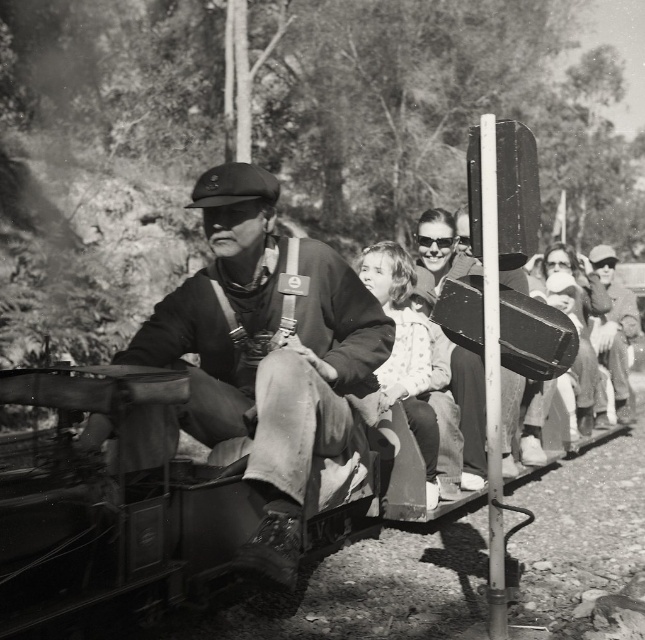
Does leather seat at center lie in front of light beige fabric dress at center?

Yes, leather seat at center is in front of light beige fabric dress at center.

Based on the photo, can you confirm if leather seat at center is positioned above light beige fabric dress at center?

No.

Is point (342, 392) closer to viewer compared to point (372, 282)?

Yes, it is in front of point (372, 282).

This screenshot has height=640, width=645. In order to click on leather seat at center in this screenshot , I will do `click(268, 349)`.